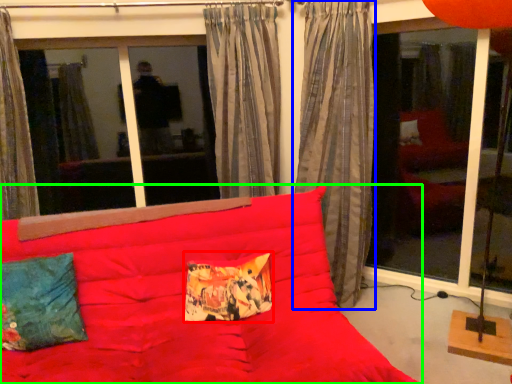
Question: Considering the real-world distances, which object is farthest from pillow (highlighted by a red box)? curtain (highlighted by a blue box) or studio couch (highlighted by a green box)?

Choices:
 (A) curtain
 (B) studio couch

Answer: (A)